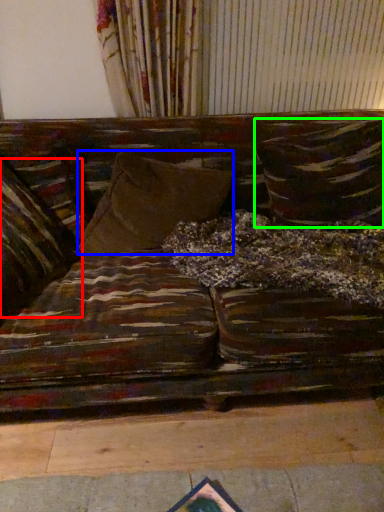
Question: Based on their relative distances, which object is farther from pillow (highlighted by a red box)? Choose from pillow (highlighted by a blue box) and pillow (highlighted by a green box).

Choices:
 (A) pillow
 (B) pillow

Answer: (B)